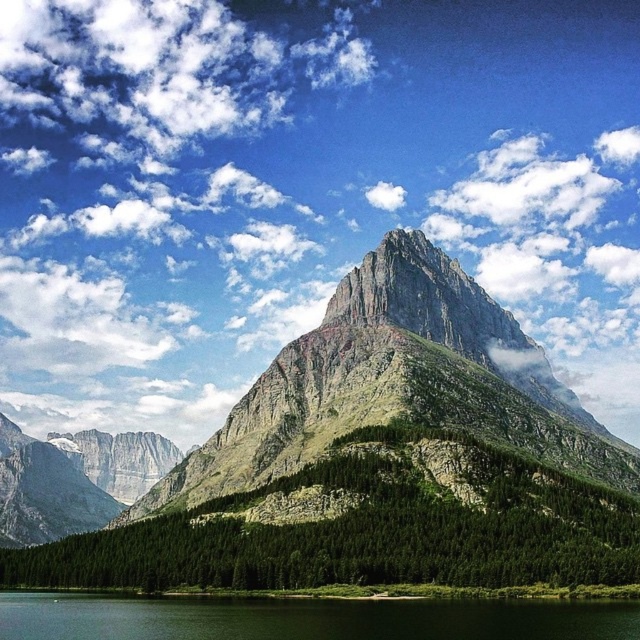
You are planning to hike up the green grassy mountain at center and need to cross the green grassy shore at lower center first. Which area requires more time to traverse based on their sizes?

The green grassy mountain at center is bigger than the green grassy shore at lower center, so it would require more time to traverse.

Based on the photo, based on the scene description, what does the point at coordinates (x=380, y=461) represent?

The point at coordinates (x=380, y=461) represents the green grassy mountain at center.

You are standing at a viewpoint and want to take a photo of the green grassy mountain at center. If your camera can focus on objects up to 500 feet away, will it be able to capture the mountain clearly?

The green grassy mountain at center and camera are 455.19 feet apart from each other. Since the distance is less than 500 feet, the camera can focus on the mountain and capture it clearly.